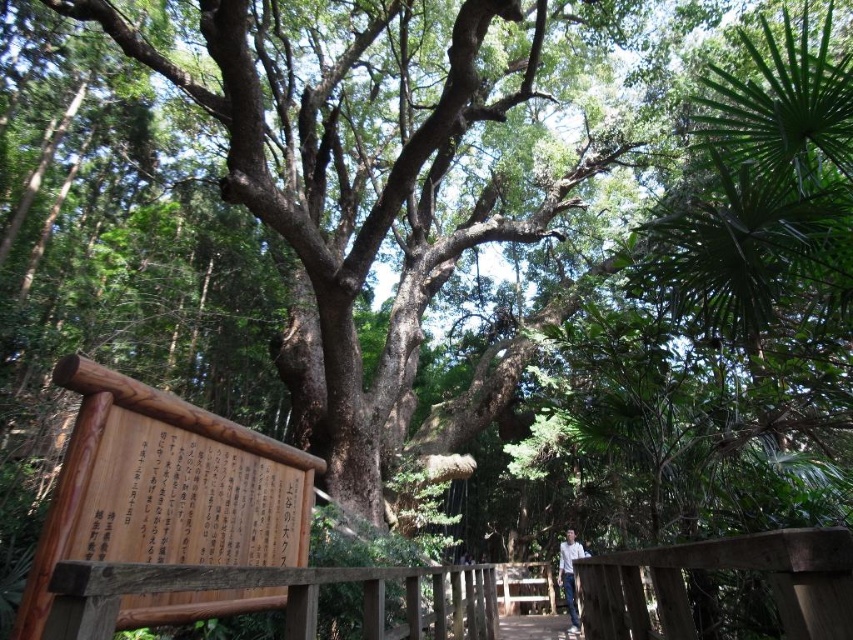
You are standing in the forest and want to take a photo of the ancient tree. There is a point at coordinates point (294, 634) that is 5.45 feet from the camera. Can you tell me how far this point is from the camera?

The point at coordinates point (294, 634) is 5.45 feet from the camera.

You are standing at the bottom left corner of the image. You want to walk to the wooden bridge at center. In which direction should you move first?

Since the wooden bridge at center is located at point 0.981 on the x axis and 0.628 on the y axis, you should move to the right first to reach it.